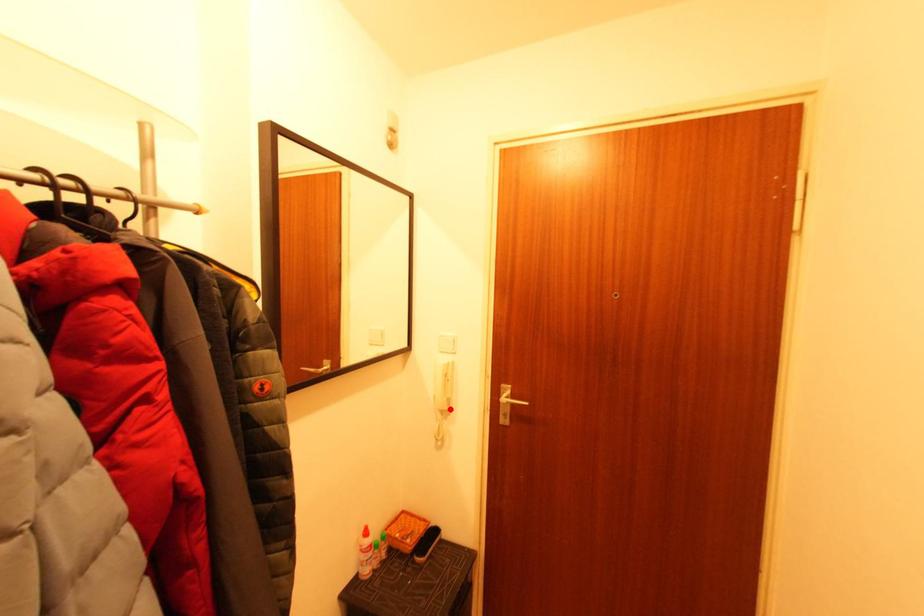
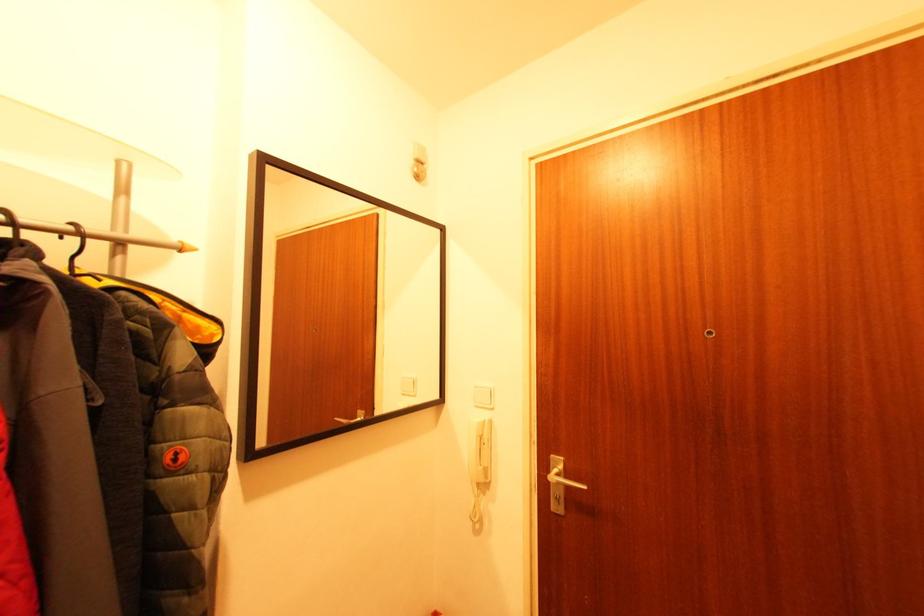
Find the pixel in the second image that matches the highlighted location in the first image.

(487, 480)